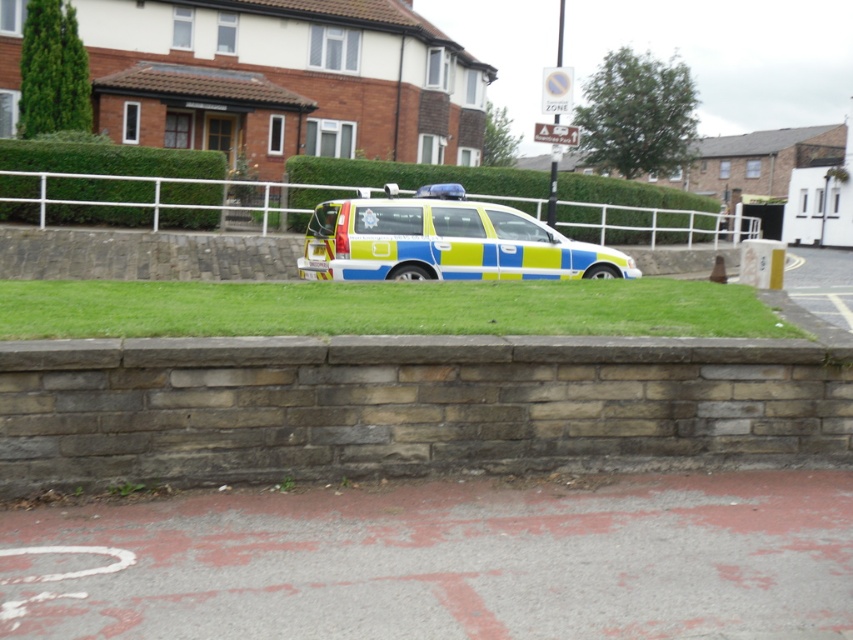
What is located at the coordinates point (445, 241) in the image?

The blue green metallic van at center is located at point (445, 241).